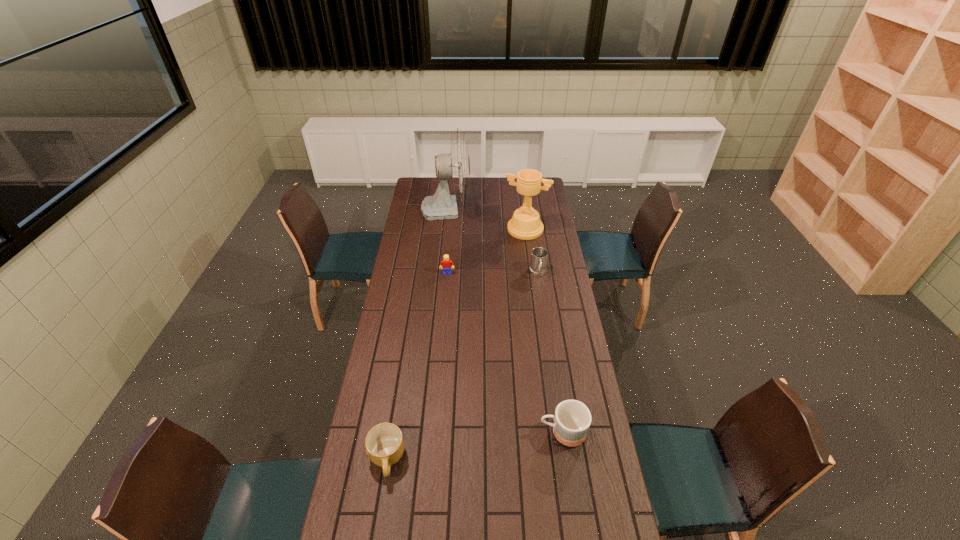
The height and width of the screenshot is (540, 960). I want to click on the tallest object, so click(x=456, y=165).

Find the location of a particular element. The height and width of the screenshot is (540, 960). the fifth shortest object is located at coordinates (525, 224).

Find the location of a particular element. The image size is (960, 540). the farthest mug is located at coordinates (538, 262).

Locate an element on the screen. Lego is located at coordinates (446, 264).

Locate an element on the screen. the leftmost mug is located at coordinates (384, 443).

I want to click on the shortest object, so click(384, 443).

You are a GUI agent. You are given a task and a screenshot of the screen. Output one action in this format:
    pyautogui.click(x=<x>, y=<y>)
    Task: Click on the free region located in front of the tallest object to blow air
    
    Given the screenshot: What is the action you would take?
    pyautogui.click(x=482, y=208)

Locate an element on the screen. The height and width of the screenshot is (540, 960). vacant region located 0.170m on the front of the fifth shortest object is located at coordinates (529, 261).

The width and height of the screenshot is (960, 540). I want to click on vacant area situated 0.070m on the side of the farthest mug with the handle, so click(x=540, y=292).

Identify the location of vacant space situated 0.340m on the face of the Lego. The height and width of the screenshot is (540, 960). (443, 328).